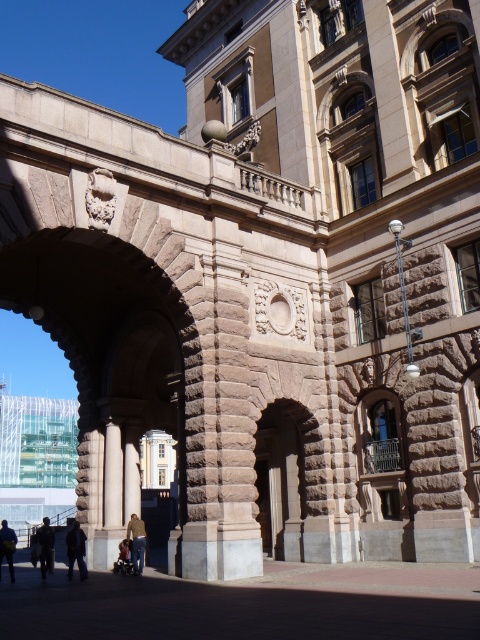
You are standing at the entrance of the grand historic building and want to locate the brown stone pillar at center. According to the coordinates provided, where should you look relative to the entrance?

The brown stone pillar at center is located at coordinates point (x=132, y=472), which means it is positioned to the right and slightly above the entrance area.